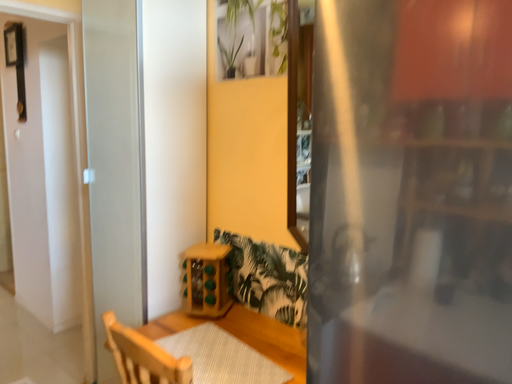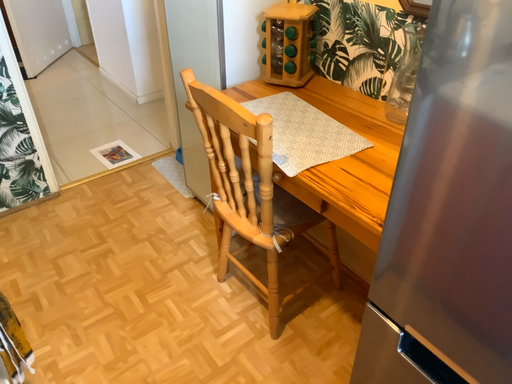
Question: Which way did the camera rotate in the video?

Choices:
 (A) rotated upward
 (B) rotated downward

Answer: (B)